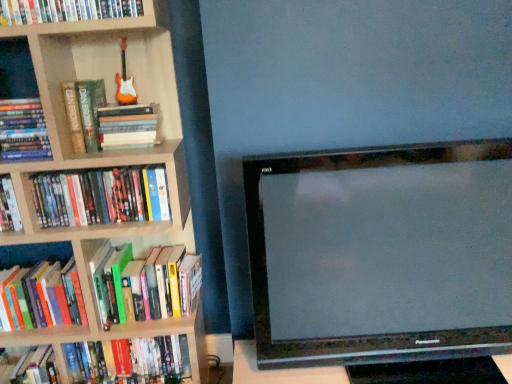
Describe the element at coordinates (44, 297) in the screenshot. This screenshot has height=384, width=512. I see `hardcover book at left, marked as the first book in a bottom-to-top arrangement` at that location.

This screenshot has width=512, height=384. I want to click on hardcover books at left, which is the second book in top-to-bottom order, so click(129, 126).

Image resolution: width=512 pixels, height=384 pixels. What do you see at coordinates (381, 253) in the screenshot?
I see `satin black television at center` at bounding box center [381, 253].

The image size is (512, 384). Describe the element at coordinates (101, 196) in the screenshot. I see `hardcover book at left, the fourth book from the bottom` at that location.

Locate an element on the screen. This screenshot has height=384, width=512. hardcover book at left, which ranks as the 5th book in bottom-to-top order is located at coordinates (23, 131).

Locate an element on the screen. hardcover book at left is located at coordinates [x=84, y=113].

Considering the positions of objects hardcover book at left, marked as the first book in a bottom-to-top arrangement, and hardcover books at left, which is the second book in top-to-bottom order, in the image provided, who is behind, hardcover book at left, marked as the first book in a bottom-to-top arrangement, or hardcover books at left, which is the second book in top-to-bottom order,?

Positioned behind is hardcover book at left, marked as the first book in a bottom-to-top arrangement.

Which is behind, point (42, 269) or point (103, 147)?

The point (42, 269) is farther.

Is hardcover book at left, marked as the first book in a bottom-to-top arrangement, outside of hardcover books at left, which is the second book in top-to-bottom order?

Indeed, hardcover book at left, marked as the first book in a bottom-to-top arrangement, is completely outside hardcover books at left, which is the second book in top-to-bottom order.

Is hardcover book at left, the seventh book from the top, aimed at hardcover books at left, which is the second book in top-to-bottom order?

No, hardcover book at left, the seventh book from the top, is not aimed at hardcover books at left, which is the second book in top-to-bottom order.

Does hardcover book at left, placed as the fourth book when sorted from top to bottom, contain hardcover book at left, the seventh book from the top?

Actually, hardcover book at left, the seventh book from the top, is outside hardcover book at left, placed as the fourth book when sorted from top to bottom.

Would you consider hardcover book at left, the fourth book from the bottom, to be distant from hardcover book at left, marked as the first book in a bottom-to-top arrangement?

No, there isn't a large distance between hardcover book at left, the fourth book from the bottom, and hardcover book at left, marked as the first book in a bottom-to-top arrangement.

Does point (45, 211) appear closer or farther from the camera than point (23, 317)?

Point (45, 211) is closer to the camera than point (23, 317).

Could you tell me if hardcover book at left, the fourth book from the bottom, is turned towards hardcover book at left, the seventh book from the top?

No, hardcover book at left, the fourth book from the bottom, is not turned towards hardcover book at left, the seventh book from the top.

You are a GUI agent. You are given a task and a screenshot of the screen. Output one action in this format:
    pyautogui.click(x=<x>, y=<y>)
    Task: Click on the table that appears below the hardcover book at left, placed as the fourth book when sorted from top to bottom (from the image's perspective)
    This screenshot has height=384, width=512.
    Given the screenshot: What is the action you would take?
    pyautogui.click(x=279, y=370)

Is metallic silver table at lower right facing away from hardcover book at left, placed as the fourth book when sorted from top to bottom?

No, metallic silver table at lower right is not facing the opposite direction of hardcover book at left, placed as the fourth book when sorted from top to bottom.

Based on the photo, who is more distant, metallic silver table at lower right or hardcover book at left, placed as the fourth book when sorted from top to bottom?

hardcover book at left, placed as the fourth book when sorted from top to bottom, is more distant.

Looking at this image, considering the sizes of metallic silver table at lower right and hardcover book at left, the fourth book from the bottom, in the image, is metallic silver table at lower right wider or thinner than hardcover book at left, the fourth book from the bottom,?

In the image, metallic silver table at lower right appears to be wider than hardcover book at left, the fourth book from the bottom.

From their relative heights in the image, would you say hardcover book at left, which is counted as the third book, starting from the top, is taller or shorter than hardcover book at left, the 6th book viewed from the top?

hardcover book at left, which is counted as the third book, starting from the top, is shorter than hardcover book at left, the 6th book viewed from the top.

Looking at this image, which is less distant, (4, 112) or (123, 297)?

The point (4, 112) is in front.

What's the angular difference between hardcover book at left, which ranks as the 5th book in bottom-to-top order, and hardcover book at left, which is the second book from bottom to top,'s facing directions?

0.00291 degrees separate the facing orientations of hardcover book at left, which ranks as the 5th book in bottom-to-top order, and hardcover book at left, which is the second book from bottom to top.

From the picture: From a real-world perspective, which is physically below, hardcover book at left, which is counted as the third book, starting from the top, or hardcover book at left, the 6th book viewed from the top?

In real-world perspective, hardcover book at left, the 6th book viewed from the top, is lower.

Is wooden bookshelf at left located within hardcover book at left, marked as the first book in a bottom-to-top arrangement?

No.

Is hardcover book at left, marked as the first book in a bottom-to-top arrangement, oriented towards wooden bookshelf at left?

Yes, hardcover book at left, marked as the first book in a bottom-to-top arrangement, is turned towards wooden bookshelf at left.

How different are the orientations of hardcover book at left, the seventh book from the top, and wooden bookshelf at left in degrees?

2.98 degrees.

Between point (33, 314) and point (163, 91), which one is positioned behind?

The point (33, 314) is farther.

Consider the image. Who is shorter, hardcover books at left, which is the second book in top-to-bottom order, or hardcover book at left, the 6th book viewed from the top?

With less height is hardcover books at left, which is the second book in top-to-bottom order.

From the image's perspective, between hardcover books at left, placed as the sixth book when sorted from bottom to top, and hardcover book at left, which is the second book from bottom to top, who is located below?

hardcover book at left, which is the second book from bottom to top, is shown below in the image.

From a real-world perspective, which is physically below, hardcover books at left, which is the second book in top-to-bottom order, or hardcover book at left, the 6th book viewed from the top?

hardcover book at left, the 6th book viewed from the top.

Based on the photo, is hardcover book at left, the fifth book in the top-to-bottom sequence, spatially inside hardcover books at left, which is the second book in top-to-bottom order, or outside of it?

hardcover book at left, the fifth book in the top-to-bottom sequence, exists outside the volume of hardcover books at left, which is the second book in top-to-bottom order.

Image resolution: width=512 pixels, height=384 pixels. There is a hardcover books at left, which is the second book in top-to-bottom order. Find the location of `the 3rd book below it (from the image's perspective)`. the 3rd book below it (from the image's perspective) is located at coordinates (9, 206).

Looking at this image, can you confirm if hardcover book at left, the fifth book in the top-to-bottom sequence, is thinner than hardcover books at left, placed as the sixth book when sorted from bottom to top?

Yes.

Considering the positions of points (5, 176) and (130, 129), is point (5, 176) closer to camera compared to point (130, 129)?

Yes, point (5, 176) is in front of point (130, 129).

Where is `the 4th book to the left of the hardcover books at left, placed as the sixth book when sorted from bottom to top, counting from the anchor's position`? This screenshot has height=384, width=512. the 4th book to the left of the hardcover books at left, placed as the sixth book when sorted from bottom to top, counting from the anchor's position is located at coordinates (44, 297).

From a real-world perspective, which book is the 2nd one underneath the hardcover book at left, the fourth book from the bottom? Please provide its 2D coordinates.

[(44, 297)]

When comparing their distances from metallic silver table at lower right, does hardcover book at left, which is counted as the third book, starting from the bottom, or hardcover book at left, which ranks as the 5th book in bottom-to-top order, seem further?

Among the two, hardcover book at left, which ranks as the 5th book in bottom-to-top order, is located further to metallic silver table at lower right.

Based on their spatial positions, is hardcover books at left, which is the second book in top-to-bottom order, or metallic silver table at lower right closer to hardcover book at left, which is counted as the third book, starting from the bottom?

Based on the image, hardcover books at left, which is the second book in top-to-bottom order, appears to be nearer to hardcover book at left, which is counted as the third book, starting from the bottom.

Looking at this image, looking at the image, which one is located further to hardcover book at left, marked as the first book in a bottom-to-top arrangement, hardcover book at left, the 6th book viewed from the top, or satin black television at center?

The object further to hardcover book at left, marked as the first book in a bottom-to-top arrangement, is satin black television at center.

Based on their spatial positions, is hardcover book at left, which ranks as the 5th book in bottom-to-top order, or hardcover book at upper left, positioned as the first book in top-to-bottom order, further from metallic silver table at lower right?

hardcover book at upper left, positioned as the first book in top-to-bottom order, lies further to metallic silver table at lower right than the other object.

Based on their spatial positions, is hardcover book at left or hardcover book at left, the fourth book from the bottom, closer to hardcover book at left, marked as the first book in a bottom-to-top arrangement?

hardcover book at left, the fourth book from the bottom, is closer to hardcover book at left, marked as the first book in a bottom-to-top arrangement.

When comparing their distances from wooden bookshelf at left, does metallic silver table at lower right or hardcover book at left, which is counted as the third book, starting from the bottom, seem further?

Based on the image, metallic silver table at lower right appears to be further to wooden bookshelf at left.

Estimate the real-world distances between objects in this image. Which object is closer to hardcover book at left, placed as the fourth book when sorted from top to bottom, hardcover book at left, the fifth book in the top-to-bottom sequence, or hardcover books at left, which is the second book in top-to-bottom order?

hardcover books at left, which is the second book in top-to-bottom order, lies closer to hardcover book at left, placed as the fourth book when sorted from top to bottom, than the other object.

Looking at the image, which one is located closer to wooden bookshelf at left, metallic silver table at lower right or hardcover books at left, placed as the sixth book when sorted from bottom to top?

hardcover books at left, placed as the sixth book when sorted from bottom to top, is closer to wooden bookshelf at left.

At what (x,y) coordinates should I click in order to perform the action: click on paperback book situated between wooden bookshelf at left and metallic silver table at lower right from left to right. Please return your answer as a coordinate pair (x, y). This screenshot has height=384, width=512. Looking at the image, I should click on (84, 113).

Locate an element on the screen. television between hardcover book at left and metallic silver table at lower right is located at coordinates (381, 253).

Locate an element on the screen. Image resolution: width=512 pixels, height=384 pixels. paperback book between hardcover book at left, the fifth book in the top-to-bottom sequence, and hardcover books at left, which is the second book in top-to-bottom order, in the horizontal direction is located at coordinates (84, 113).

Identify the location of paperback book between hardcover book at left, which ranks as the 5th book in bottom-to-top order, and satin black television at center from left to right. This screenshot has height=384, width=512. (84, 113).